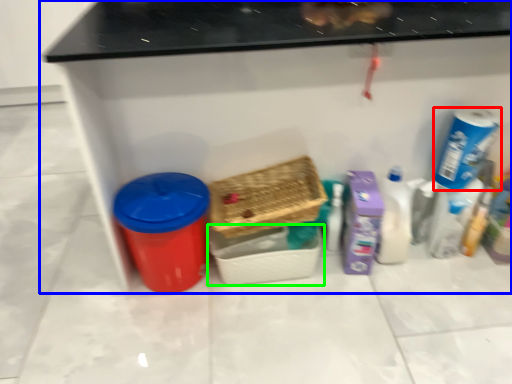
Question: Which is nearer to the cleaning product (highlighted by a red box)? furniture (highlighted by a blue box) or basket (highlighted by a green box).

Choices:
 (A) furniture
 (B) basket

Answer: (A)